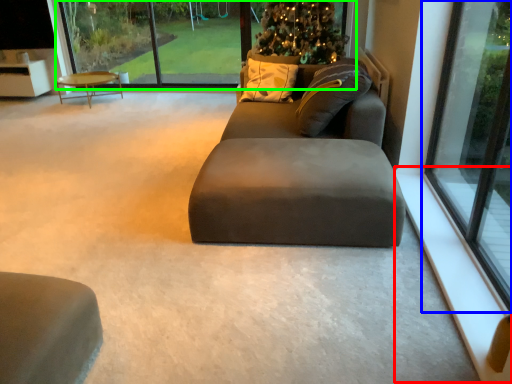
Question: Which is nearer to the window sill (highlighted by a red box)? window (highlighted by a blue box) or glass window (highlighted by a green box).

Choices:
 (A) window
 (B) glass window

Answer: (A)